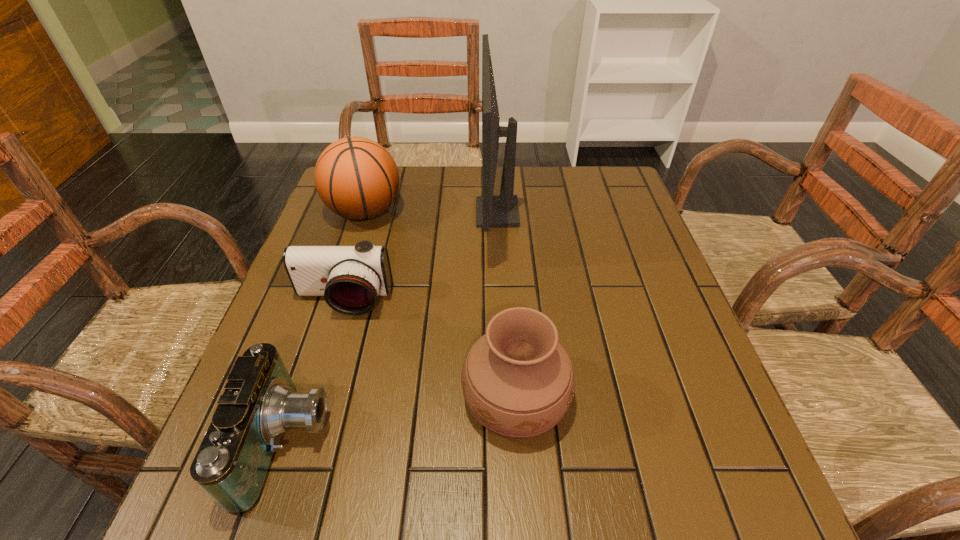
The height and width of the screenshot is (540, 960). I want to click on free space located 0.390m on the front-facing side of the nearer camcorder, so click(x=554, y=441).

At what (x,y) coordinates should I click in order to perform the action: click on vacant space located on the surface of the third farthest object. Please return your answer as a coordinate pair (x, y). This screenshot has height=540, width=960. Looking at the image, I should click on (328, 350).

You are a GUI agent. You are given a task and a screenshot of the screen. Output one action in this format:
    pyautogui.click(x=<x>, y=<y>)
    Task: Click on the computer monitor present at the far edge
    This screenshot has width=960, height=540.
    Given the screenshot: What is the action you would take?
    pyautogui.click(x=502, y=211)

Image resolution: width=960 pixels, height=540 pixels. Identify the location of basketball that is positioned at the far edge. pyautogui.click(x=356, y=178).

This screenshot has height=540, width=960. Find the location of `object that is positioned at the near edge`. object that is positioned at the near edge is located at coordinates (260, 403).

At what (x,y) coordinates should I click in order to perform the action: click on basketball that is at the left edge. Please return your answer as a coordinate pair (x, y). Looking at the image, I should click on (356, 178).

The height and width of the screenshot is (540, 960). Identify the location of object that is positioned at the far left corner. (356, 178).

Locate an element on the screen. Image resolution: width=960 pixels, height=540 pixels. object that is at the near left corner is located at coordinates (260, 403).

Where is `vacant space at the far edge of the desktop`? This screenshot has height=540, width=960. vacant space at the far edge of the desktop is located at coordinates (433, 166).

Where is `free space at the near edge`? The width and height of the screenshot is (960, 540). free space at the near edge is located at coordinates (353, 473).